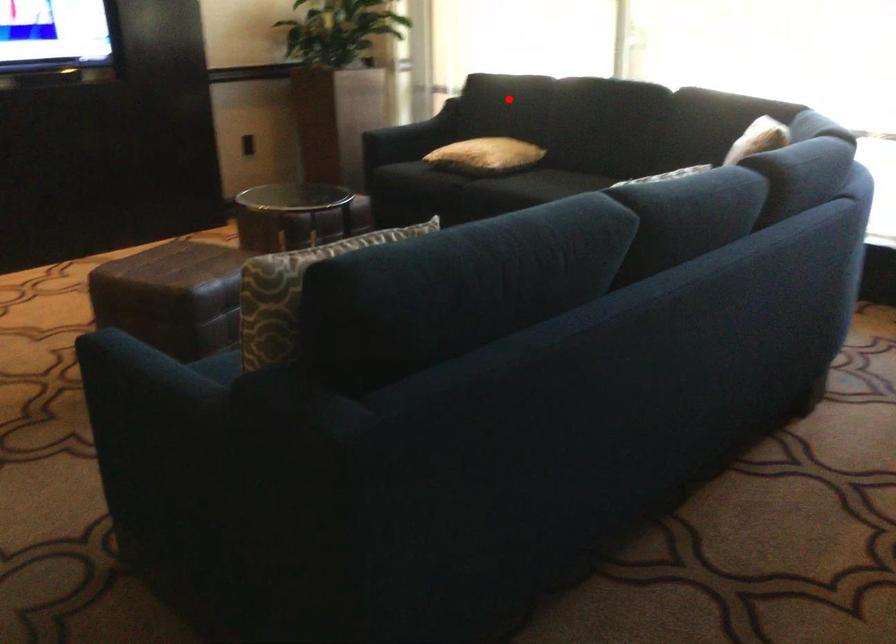
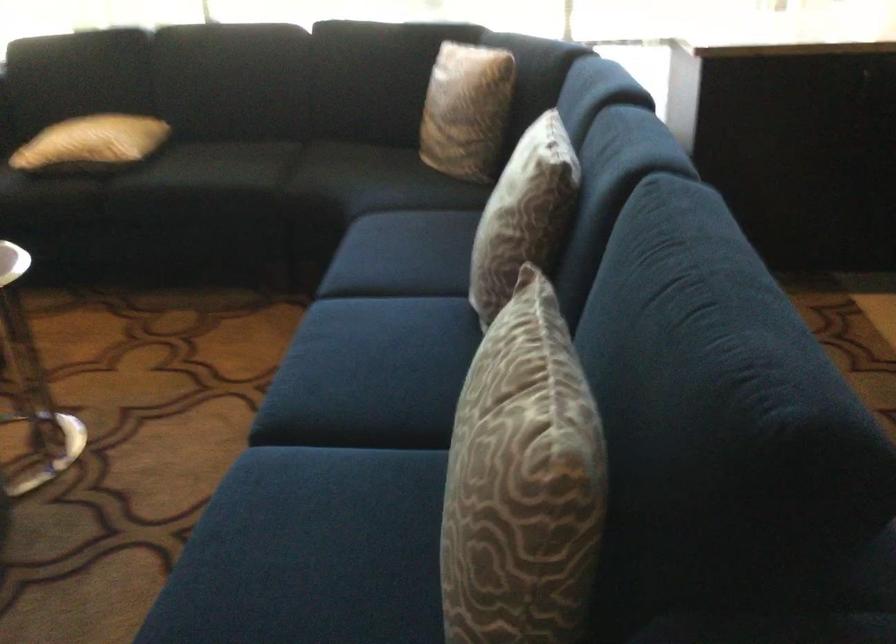
In the second image, find the point that corresponds to the highlighted location in the first image.

(82, 64)